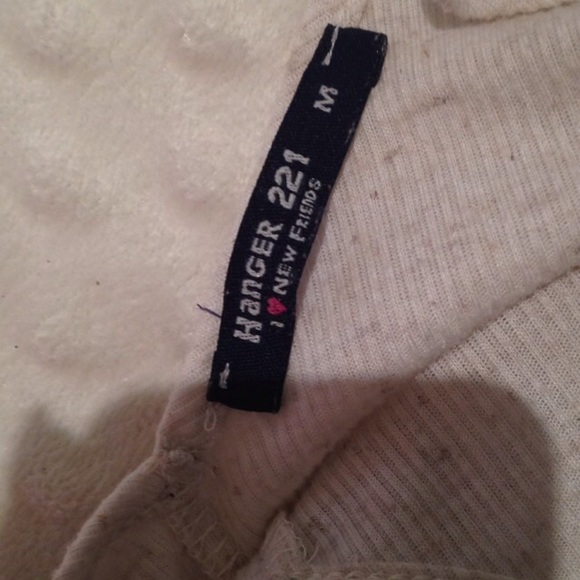
Locate an element on the screen. This screenshot has height=580, width=580. white cloth with vertical stitching is located at coordinates 422,237, 489,450.